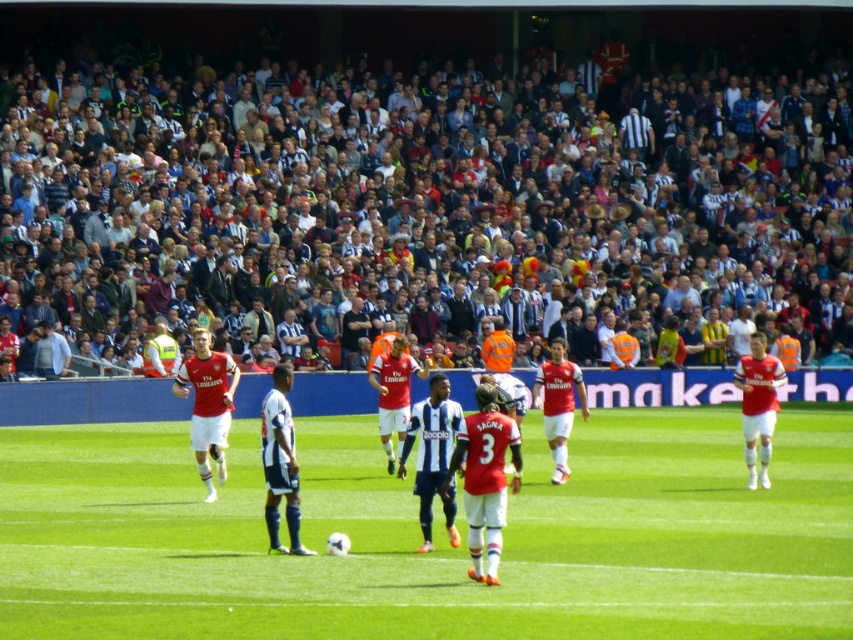
You are a soccer player on the field and you want to kick the ball to the goal. Where is the white smooth soccer ball at center located in relation to the point marked as (433, 536)?

The point marked as (433, 536) is exactly where the white smooth soccer ball at center is located.